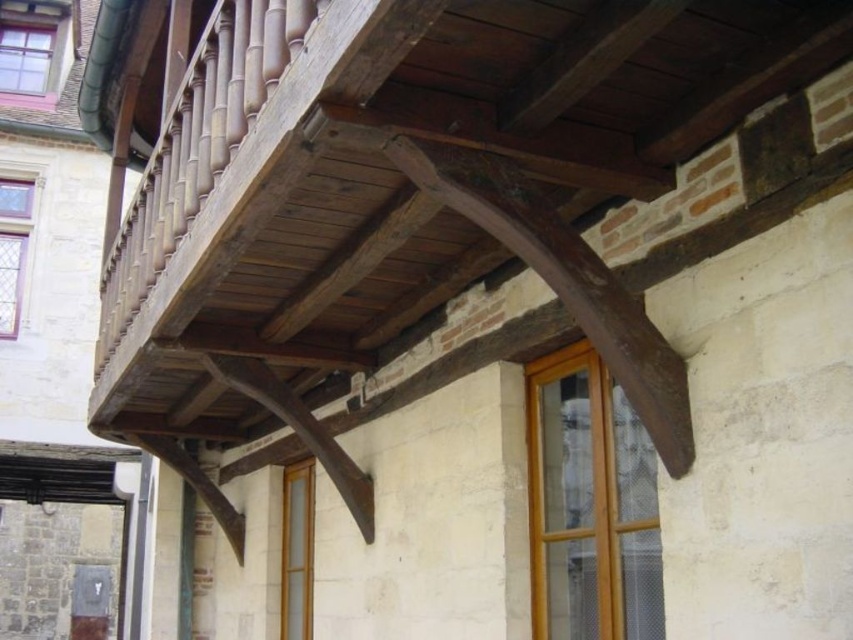
Question: Which of the following is the closest to the observer?

Choices:
 (A) pyautogui.click(x=662, y=109)
 (B) pyautogui.click(x=529, y=410)
 (C) pyautogui.click(x=22, y=33)
 (D) pyautogui.click(x=10, y=337)

Answer: (A)

Question: Does clear glass window at center appear on the left side of clear glass door at center?

Choices:
 (A) no
 (B) yes

Answer: (A)

Question: Can you confirm if weathered wood balcony at upper center is positioned above clear glass window at center?

Choices:
 (A) no
 (B) yes

Answer: (B)

Question: Which object is positioned farthest from the matte pink glass window at upper left?

Choices:
 (A) clear glass window at upper left
 (B) weathered wood balcony at upper center
 (C) clear glass door at center

Answer: (B)

Question: Which object is farther from the camera taking this photo?

Choices:
 (A) clear glass window at upper left
 (B) clear glass window at center
 (C) weathered wood balcony at upper center
 (D) clear glass door at center

Answer: (A)

Question: Is weathered wood balcony at upper center wider than matte pink glass window at upper left?

Choices:
 (A) no
 (B) yes

Answer: (B)